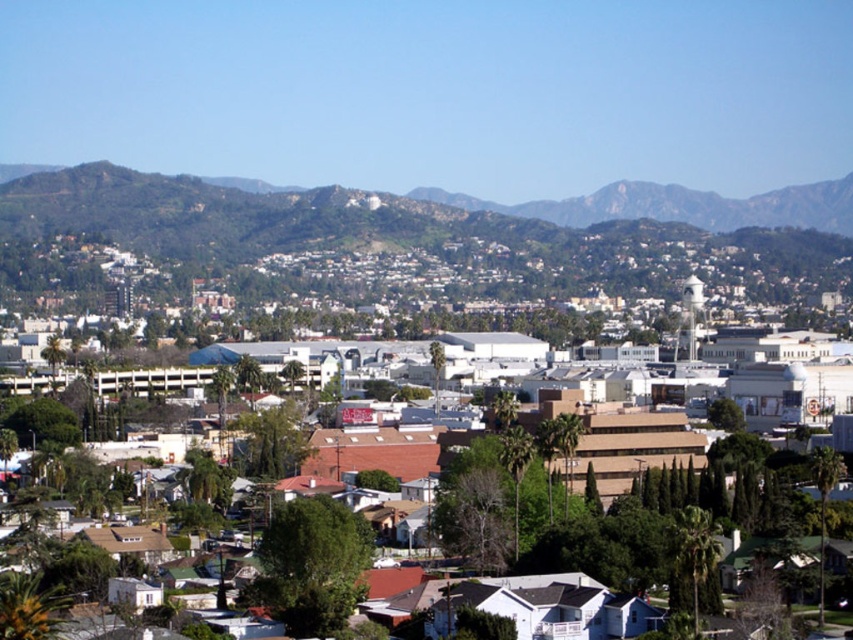
Who is shorter, green textured hillside at upper center or brown matte building at center?

green textured hillside at upper center is shorter.

Is green textured hillside at upper center below brown matte building at center?

Incorrect, green textured hillside at upper center is not positioned below brown matte building at center.

Image resolution: width=853 pixels, height=640 pixels. Describe the element at coordinates (235, 212) in the screenshot. I see `green textured hillside at upper center` at that location.

This screenshot has height=640, width=853. In order to click on green textured hillside at upper center in this screenshot , I will do `click(235, 212)`.